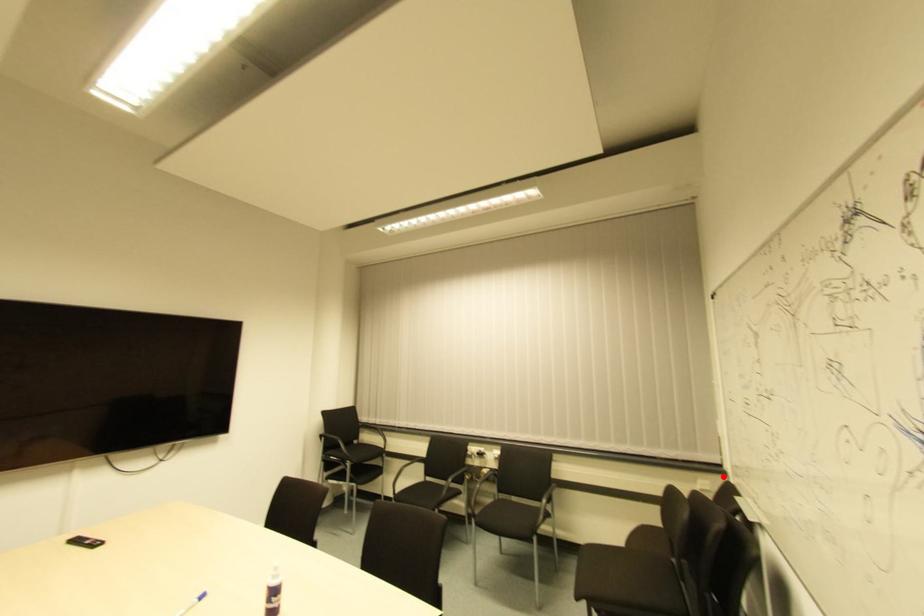
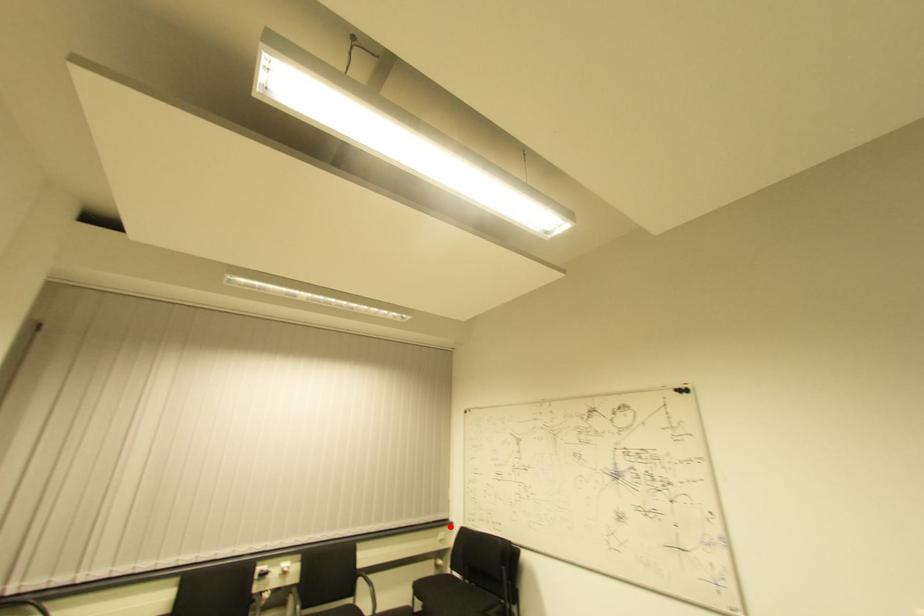
I am providing you with two images of the same scene from different viewpoints. A red point is marked on the first image and another point is marked on the second image. Do the highlighted points in image1 and image2 indicate the same real-world spot?

Yes